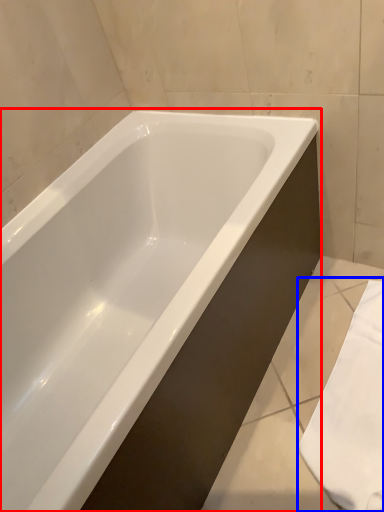
Question: Which of the following is the closest to the observer, bathtub (highlighted by a red box) or bath towel (highlighted by a blue box)?

Choices:
 (A) bathtub
 (B) bath towel

Answer: (A)